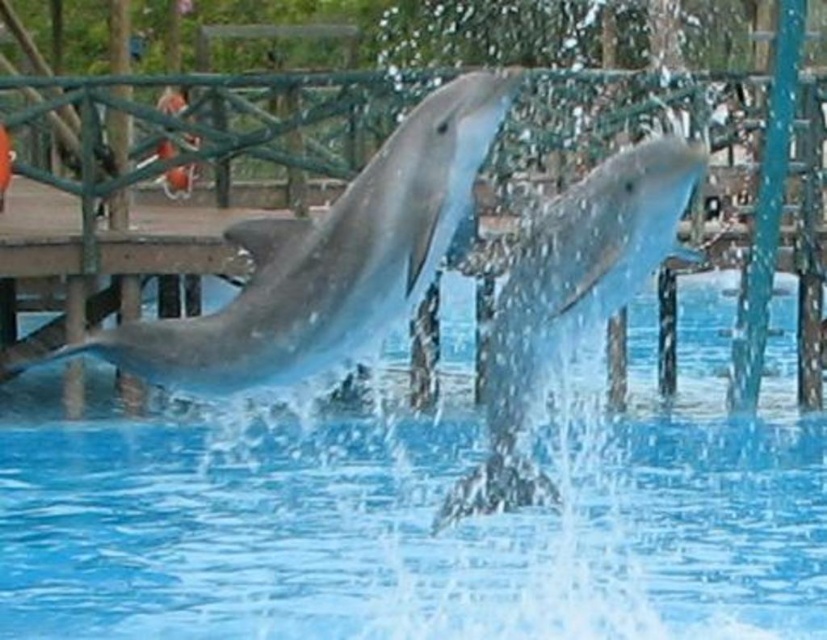
Is point (252, 481) closer to viewer compared to point (539, 216)?

No, (252, 481) is behind (539, 216).

Is the position of clear blue water at center more distant than that of slick gray dolphin at center?

Yes.

Which is behind, point (784, 408) or point (507, 451)?

Positioned behind is point (784, 408).

At what (x,y) coordinates should I click in order to perform the action: click on clear blue water at center. Please return your answer as a coordinate pair (x, y). Image resolution: width=827 pixels, height=640 pixels. Looking at the image, I should click on (419, 522).

Does clear blue water at center have a smaller size compared to smooth gray dolphin at center?

No.

Between point (512, 634) and point (304, 230), which one is positioned in front?

Positioned in front is point (304, 230).

Which is behind, point (376, 600) or point (289, 305)?

Positioned behind is point (376, 600).

The height and width of the screenshot is (640, 827). Find the location of `clear blue water at center`. clear blue water at center is located at coordinates (419, 522).

Consider the image. Which is more to the right, smooth gray dolphin at center or slick gray dolphin at center?

Positioned to the right is slick gray dolphin at center.

Who is taller, smooth gray dolphin at center or slick gray dolphin at center?

slick gray dolphin at center

Image resolution: width=827 pixels, height=640 pixels. In order to click on smooth gray dolphin at center in this screenshot , I will do `click(326, 260)`.

At what (x,y) coordinates should I click in order to perform the action: click on smooth gray dolphin at center. Please return your answer as a coordinate pair (x, y). The height and width of the screenshot is (640, 827). Looking at the image, I should click on (326, 260).